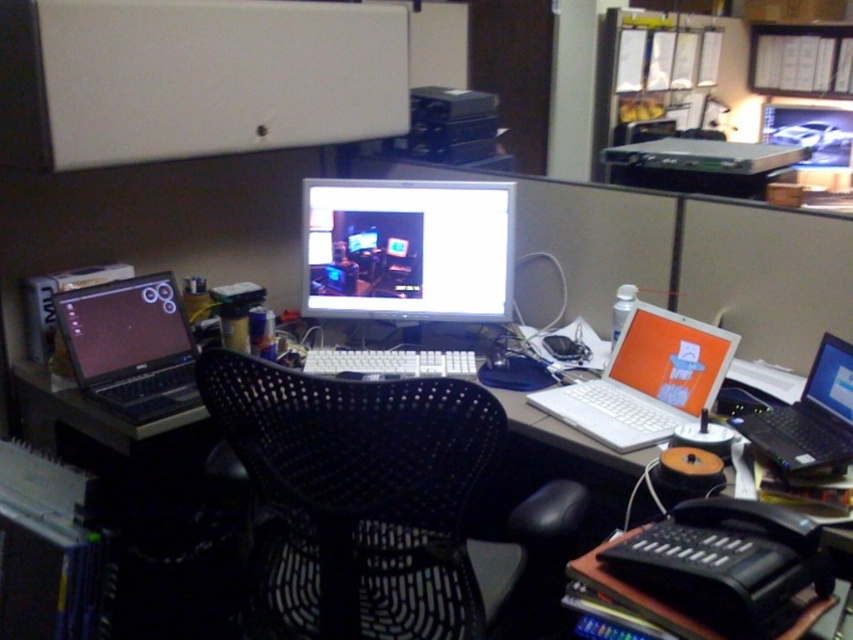
Consider the image. You are standing at the desk in the office cubicle. There is a point at coordinates [376,504]. Which object is this point located on?

The point at coordinates [376,504] is located on the black mesh swivel chair at center.

You are standing in an office and need to locate the white plastic computer desk at center. According to the scene description, where is it positioned?

The white plastic computer desk at center is located at point (111, 435).